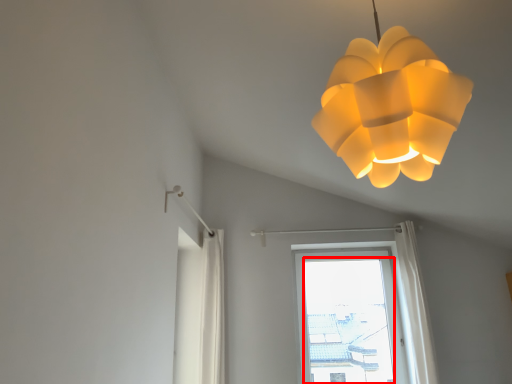
Question: Observing the image, what is the correct spatial positioning of window screen (annotated by the red box) in reference to lamp?

Choices:
 (A) left
 (B) right

Answer: (B)